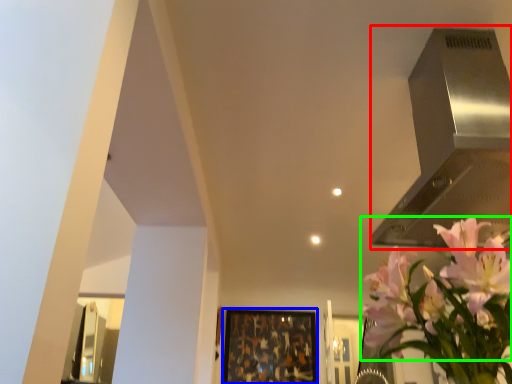
Question: Estimate the real-world distances between objects in this image. Which object is farther from vent (highlighted by a red box), picture frame (highlighted by a blue box) or flower (highlighted by a green box)?

Choices:
 (A) picture frame
 (B) flower

Answer: (A)